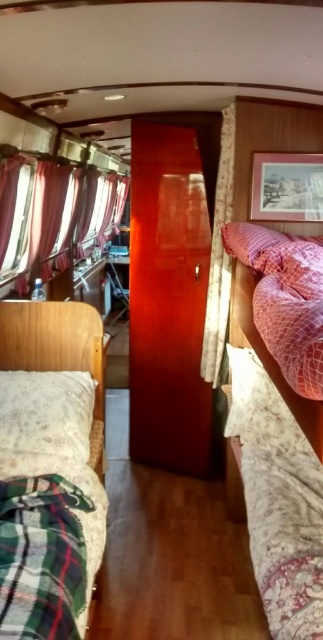
Is green plaid fabric at lower left to the left of white textured pillow at lower left from the viewer's perspective?

Incorrect, green plaid fabric at lower left is not on the left side of white textured pillow at lower left.

From the picture: Between green plaid fabric at lower left and white textured pillow at lower left, which one has more height?

white textured pillow at lower left is taller.

Image resolution: width=323 pixels, height=640 pixels. I want to click on green plaid fabric at lower left, so click(x=41, y=557).

Is point (247, 504) more distant than point (7, 280)?

No, (247, 504) is in front of (7, 280).

What do you see at coordinates (279, 499) in the screenshot?
I see `fluffy pink bed at center` at bounding box center [279, 499].

Locate an element on the screen. This screenshot has width=323, height=640. fluffy pink bed at center is located at coordinates (279, 499).

Is white textured pillow at lower left taller than pink mesh pillow at center?

No, white textured pillow at lower left is not taller than pink mesh pillow at center.

Is white textured pillow at lower left below pink mesh pillow at center?

Yes.

Is point (76, 454) positioned after point (260, 236)?

No, (76, 454) is in front of (260, 236).

At what (x,y) coordinates should I click in order to perform the action: click on white textured pillow at lower left. Please return your answer as a coordinate pair (x, y). The width and height of the screenshot is (323, 640). Looking at the image, I should click on (44, 420).